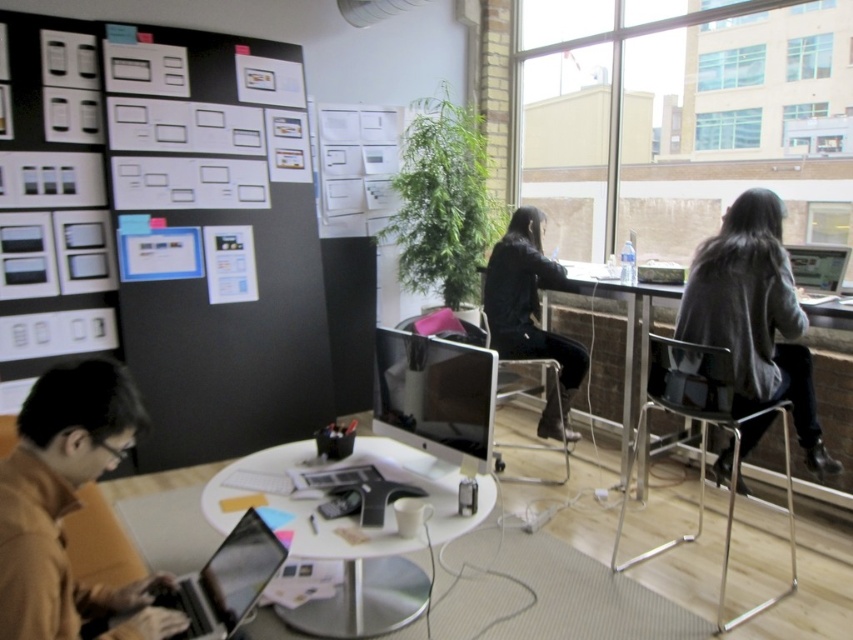
Which of these two, white glossy computer desk at center or black matte jacket at center, stands taller?

black matte jacket at center is taller.

Who is positioned more to the left, white glossy computer desk at center or black matte jacket at center?

white glossy computer desk at center

Who is more distant from viewer, (311,445) or (554,428)?

Positioned behind is point (554,428).

This screenshot has width=853, height=640. I want to click on white glossy computer desk at center, so click(x=294, y=547).

This screenshot has width=853, height=640. What do you see at coordinates (227, 580) in the screenshot? I see `silver metallic laptop at lower left` at bounding box center [227, 580].

Who is positioned more to the left, silver metallic laptop at lower left or clear plastic stool at lower center?

silver metallic laptop at lower left

I want to click on silver metallic laptop at lower left, so click(x=227, y=580).

Between satin black monitor at center and silver metallic laptop at lower left, which one appears on the right side from the viewer's perspective?

From the viewer's perspective, satin black monitor at center appears more on the right side.

Between satin black monitor at center and silver metallic laptop at lower left, which one has more height?

With more height is satin black monitor at center.

Is point (447, 362) positioned before point (270, 531)?

No, (447, 362) is behind (270, 531).

In order to click on satin black monitor at center in this screenshot , I will do `click(434, 394)`.